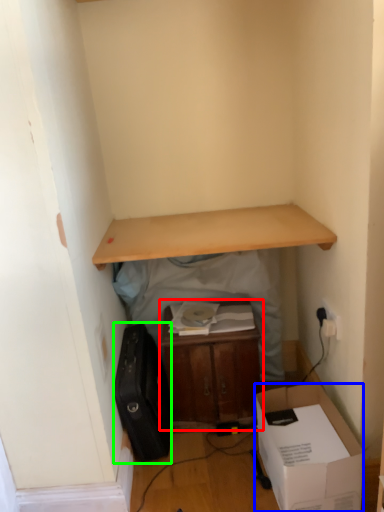
Question: Considering the real-world distances, which object is closest to table (highlighted by a red box)? box (highlighted by a blue box) or luggage (highlighted by a green box).

Choices:
 (A) box
 (B) luggage

Answer: (B)